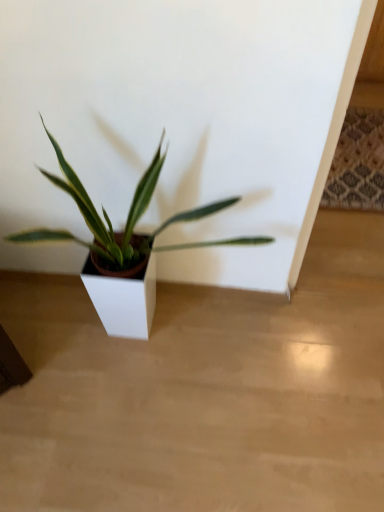
Where is `free location in front of green glossy plant at center`? free location in front of green glossy plant at center is located at coordinates coord(168,448).